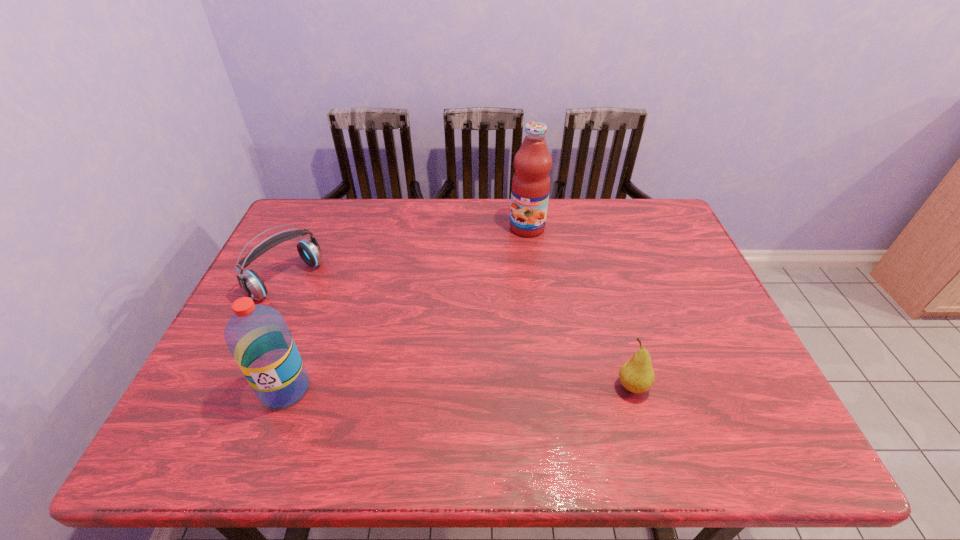
At what (x,y) coordinates should I click in order to perform the action: click on free spot on the desktop that is between the second tallest object and the rightmost object and is positioned on the ear cups of the headset. Please return your answer as a coordinate pair (x, y). This screenshot has height=540, width=960. Looking at the image, I should click on (422, 388).

Where is `vacant spot on the desktop that is between the water bottle and the rightmost object and is positioned on the front label of the fruit juice`? The height and width of the screenshot is (540, 960). vacant spot on the desktop that is between the water bottle and the rightmost object and is positioned on the front label of the fruit juice is located at coordinates (412, 388).